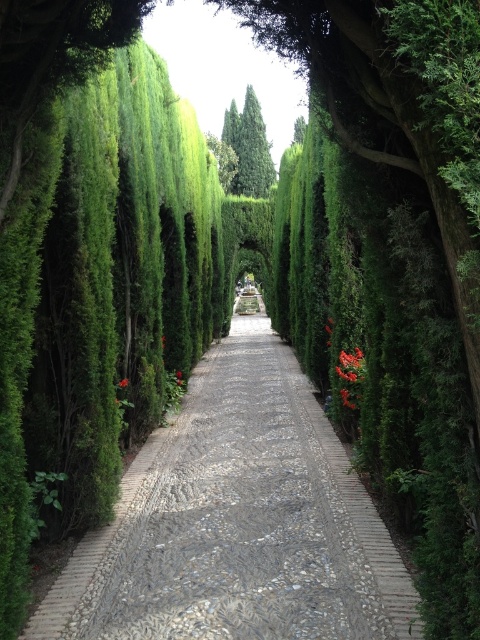
Who is higher up, green textured stone alley at center or bright red berries at center?

Positioned higher is bright red berries at center.

In the scene shown: Is green textured stone alley at center taller than bright red berries at center?

Indeed, green textured stone alley at center has a greater height compared to bright red berries at center.

Which is in front, point (325, 596) or point (337, 365)?

Positioned in front is point (325, 596).

At what (x,y) coordinates should I click in order to perform the action: click on green textured stone alley at center. Please return your answer as a coordinate pair (x, y). The image size is (480, 640). Looking at the image, I should click on (237, 522).

Which of these two, bright red berries at center or orange matte flower at center, stands shorter?

orange matte flower at center

Which is behind, point (344, 376) or point (120, 380)?

Point (120, 380)

This screenshot has width=480, height=640. What are the coordinates of `bright red berries at center` in the screenshot? It's located at (350, 365).

The image size is (480, 640). I want to click on bright red berries at center, so click(x=350, y=365).

Is green leafy tree at center to the right of orange matte flower at center from the viewer's perspective?

Yes, green leafy tree at center is to the right of orange matte flower at center.

Does green leafy tree at center have a smaller size compared to orange matte flower at center?

Incorrect, green leafy tree at center is not smaller in size than orange matte flower at center.

Locate an element on the screen. green leafy tree at center is located at coordinates click(x=249, y=147).

Identify the location of green leafy tree at center. (249, 147).